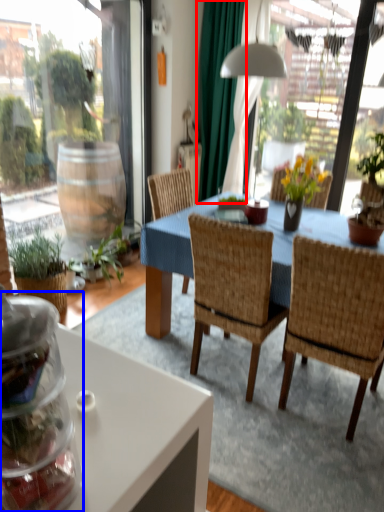
Question: Which of the following is the closest to the observer, curtain (highlighted by a red box) or glass jar (highlighted by a blue box)?

Choices:
 (A) curtain
 (B) glass jar

Answer: (B)